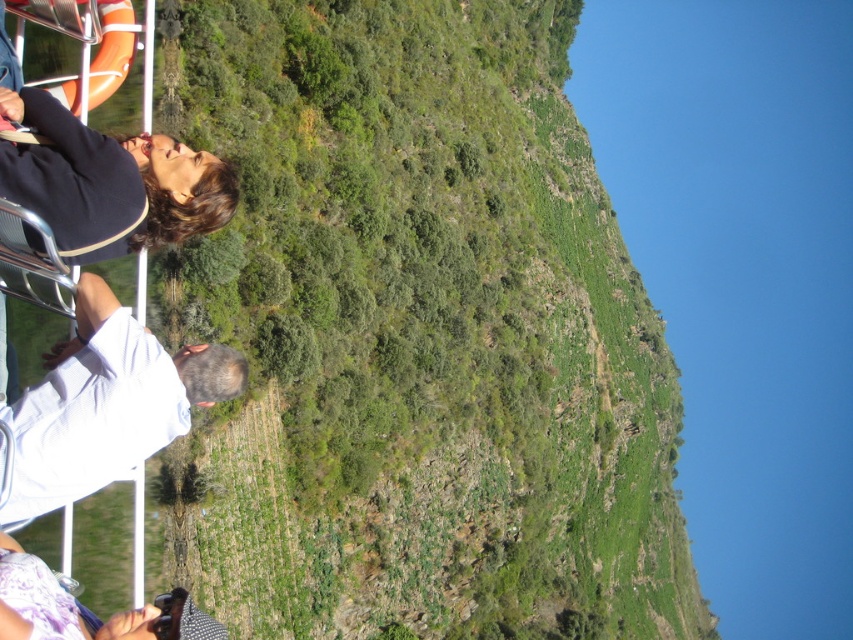
Is green leafy hillside at upper left positioned in front of white cotton shirt at lower left?

No, green leafy hillside at upper left is further to the viewer.

Based on the photo, is green leafy hillside at upper left thinner than white cotton shirt at lower left?

No.

Who is more forward, (337,506) or (196,348)?

Point (196,348) is more forward.

At what (x,y) coordinates should I click in order to perform the action: click on green leafy hillside at upper left. Please return your answer as a coordinate pair (x, y). Looking at the image, I should click on (416, 336).

Who is positioned more to the right, white cotton shirt at lower left or matte black shirt at left?

matte black shirt at left is more to the right.

Is point (45, 426) farther from viewer compared to point (3, 173)?

Yes, it is.

Where is `white cotton shirt at lower left`? The height and width of the screenshot is (640, 853). white cotton shirt at lower left is located at coordinates (106, 404).

Who is taller, green leafy hillside at upper left or matte black shirt at left?

green leafy hillside at upper left is taller.

Where is `green leafy hillside at upper left`? This screenshot has height=640, width=853. green leafy hillside at upper left is located at coordinates (416, 336).

At what (x,y) coordinates should I click in order to perform the action: click on green leafy hillside at upper left. Please return your answer as a coordinate pair (x, y). The image size is (853, 640). Looking at the image, I should click on (416, 336).